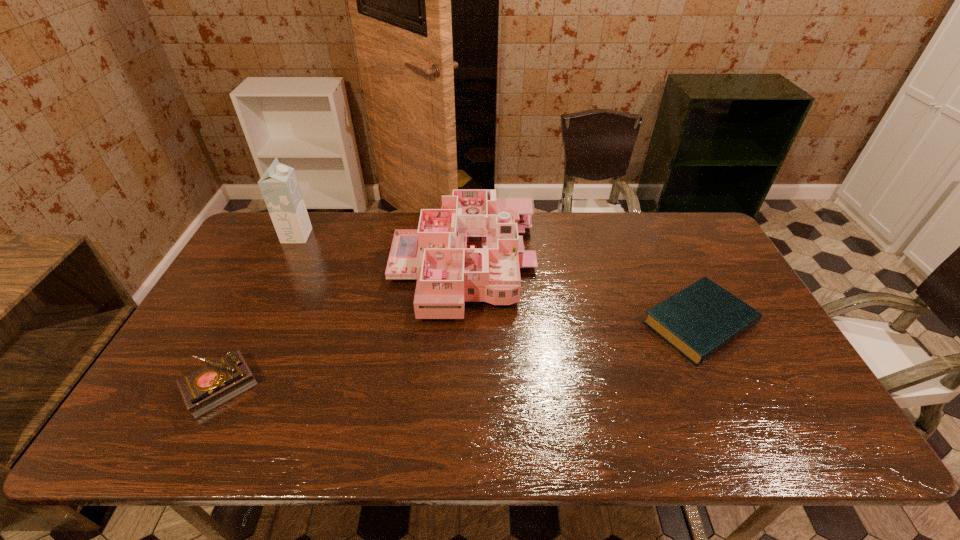
Identify the location of free space between the book and the third shortest object. (582, 294).

Find the location of `free space between the third tallest object and the shortest object`. free space between the third tallest object and the shortest object is located at coordinates (460, 355).

Where is `free space between the diary and the shortest object`? free space between the diary and the shortest object is located at coordinates pyautogui.click(x=460, y=355).

Locate an element on the screen. The height and width of the screenshot is (540, 960). object that is the closest to the second object from right to left is located at coordinates (701, 319).

Locate which object is the third closest to the dollhouse. Please provide its 2D coordinates. Your answer should be formatted as a tuple, i.e. [(x, y)], where the tuple contains the x and y coordinates of a point satisfying the conditions above.

[(279, 186)]

Where is `free spot that satisfies the following two spatial constraints: 1. on the back side of the second shortest object; 2. on the left side of the shortest object`? The image size is (960, 540). free spot that satisfies the following two spatial constraints: 1. on the back side of the second shortest object; 2. on the left side of the shortest object is located at coordinates (252, 323).

Find the location of a particular element. vacant space that satisfies the following two spatial constraints: 1. at the front entrance of the dollhouse; 2. on the front side of the third tallest object is located at coordinates (459, 386).

Identify the location of free space that satisfies the following two spatial constraints: 1. at the front entrance of the rightmost object; 2. on the right side of the second object from right to left. (462, 323).

I want to click on blank area in the image that satisfies the following two spatial constraints: 1. on the back side of the shortest object; 2. at the front entrance of the third object from left to right, so click(671, 265).

At what (x,y) coordinates should I click in order to perform the action: click on vacant position in the image that satisfies the following two spatial constraints: 1. on the front label of the tallest object; 2. on the back side of the book. Please return your answer as a coordinate pair (x, y). This screenshot has width=960, height=540. Looking at the image, I should click on (253, 323).